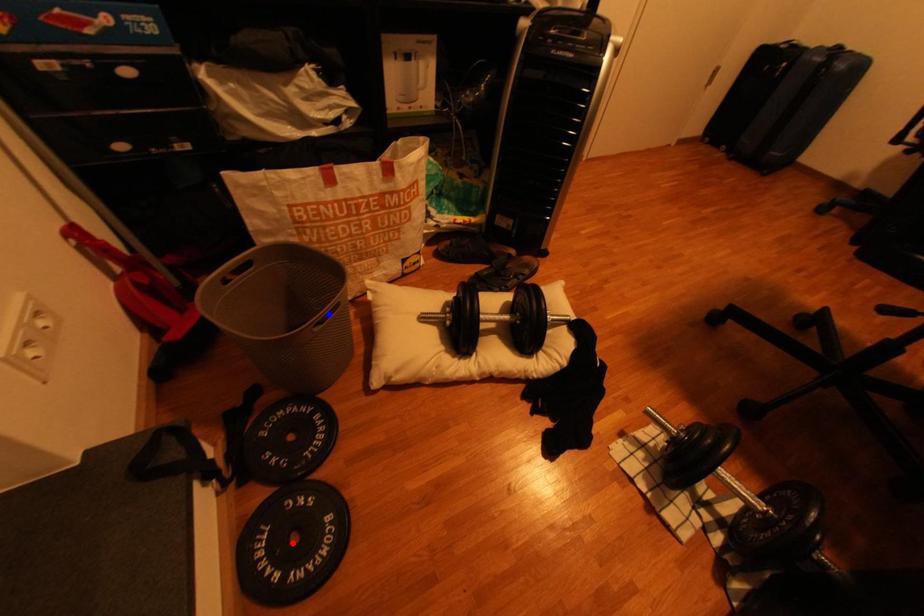
Question: Which of the two points in the image is closer to the camera?

Choices:
 (A) Blue point is closer.
 (B) Red point is closer.

Answer: (B)